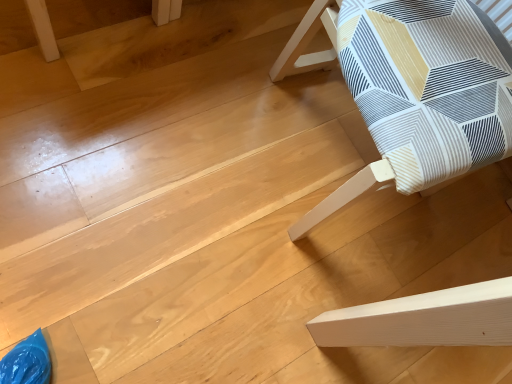
Where is `vacant space underneath white fabric chair at right, placed as the first furniture when sorted from right to left (from a real-world perspective)`? This screenshot has height=384, width=512. vacant space underneath white fabric chair at right, placed as the first furniture when sorted from right to left (from a real-world perspective) is located at coordinates (317, 139).